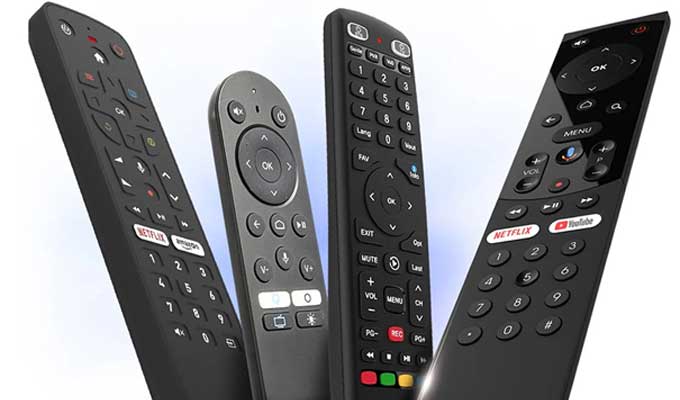
At what (x,y) coordinates should I click in order to perform the action: click on remote control. Please return your answer as a coordinate pair (x, y). Looking at the image, I should click on (90, 64), (275, 154), (377, 185), (526, 252).